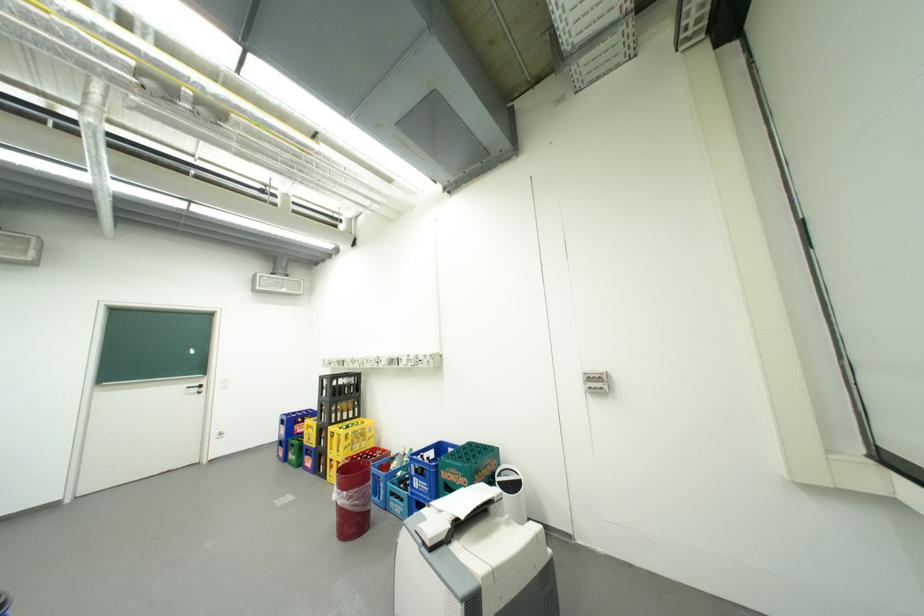
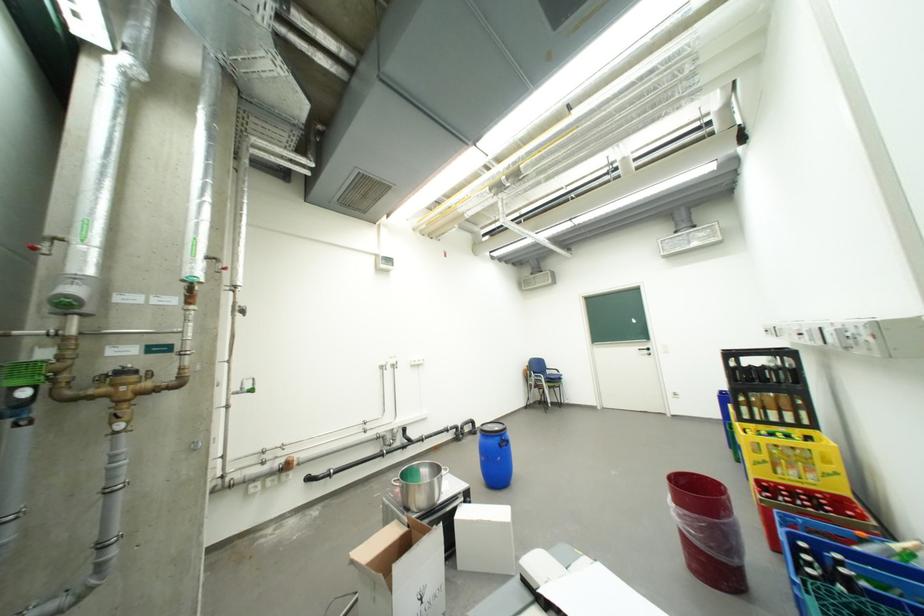
The point at (356,493) is marked in the first image. Where is the corresponding point in the second image?

(685, 507)